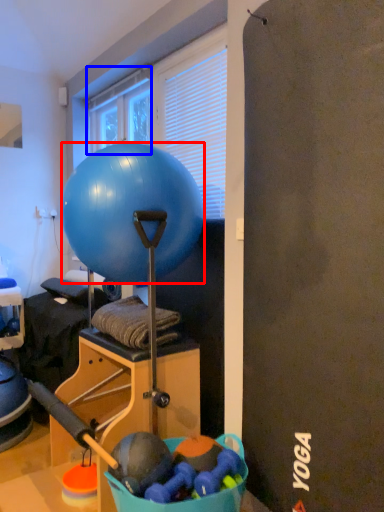
Question: Which object appears farthest to the camera in this image, ball (highlighted by a red box) or window (highlighted by a blue box)?

Choices:
 (A) ball
 (B) window

Answer: (B)